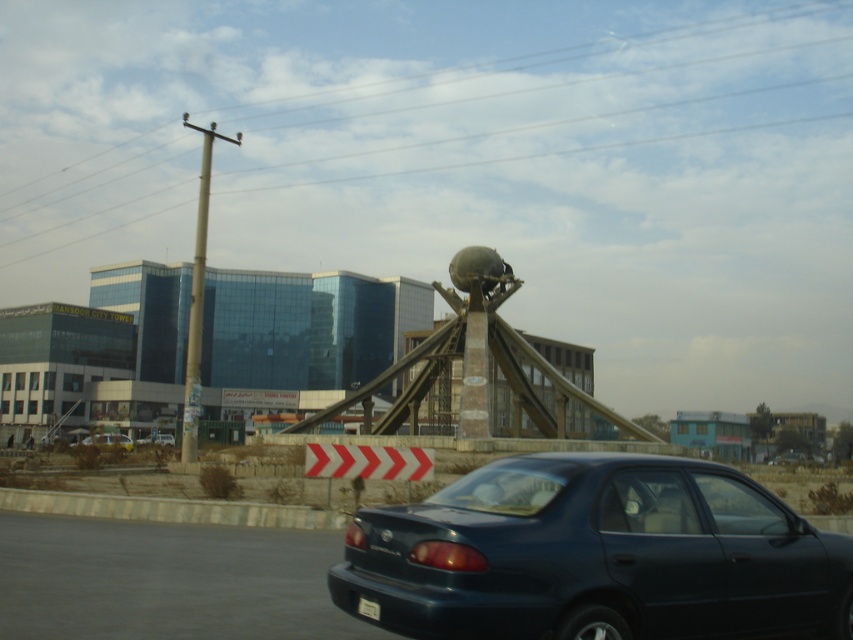
Is metallic pole at upper center wider than matte black car at lower right?

Correct, the width of metallic pole at upper center exceeds that of matte black car at lower right.

Which is more to the right, metallic pole at upper center or matte black car at lower right?

From the viewer's perspective, matte black car at lower right appears more on the right side.

Locate an element on the screen. This screenshot has height=640, width=853. metallic pole at upper center is located at coordinates (463, 163).

Is stone globe at center below metallic blue sedan at center?

No.

Image resolution: width=853 pixels, height=640 pixels. Describe the element at coordinates (473, 358) in the screenshot. I see `stone globe at center` at that location.

Is point (468, 296) farther from viewer compared to point (85, 445)?

Yes.

Locate an element on the screen. stone globe at center is located at coordinates (473, 358).

How much distance is there between metallic pole at upper center and metallic blue sedan at center?

600.37 feet

Describe the element at coordinates (463, 163) in the screenshot. I see `metallic pole at upper center` at that location.

This screenshot has width=853, height=640. Describe the element at coordinates (463, 163) in the screenshot. I see `metallic pole at upper center` at that location.

I want to click on metallic pole at upper center, so click(x=463, y=163).